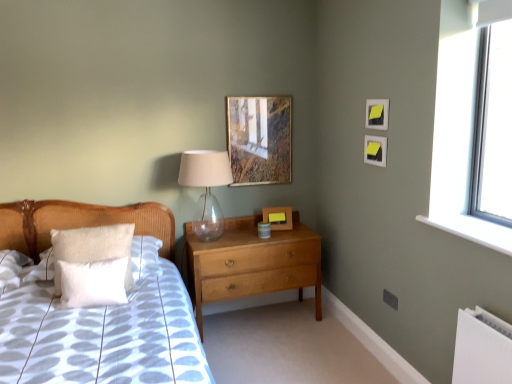
You are a GUI agent. You are given a task and a screenshot of the screen. Output one action in this format:
    pyautogui.click(x=<x>, y=<y>)
    Task: Click on the free spot in front of light brown wood chest of drawers at center
    This screenshot has width=512, height=384.
    Given the screenshot: What is the action you would take?
    pyautogui.click(x=278, y=355)